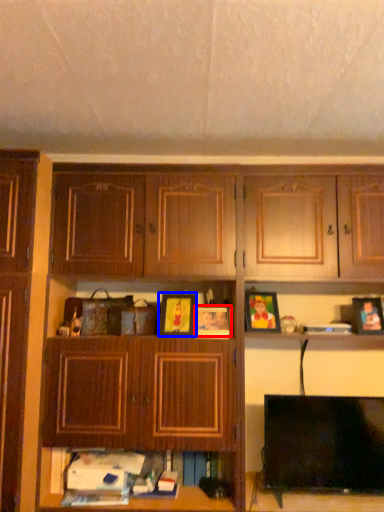
Question: Among these objects, which one is farthest to the camera, picture frame (highlighted by a red box) or picture frame (highlighted by a blue box)?

Choices:
 (A) picture frame
 (B) picture frame

Answer: (A)